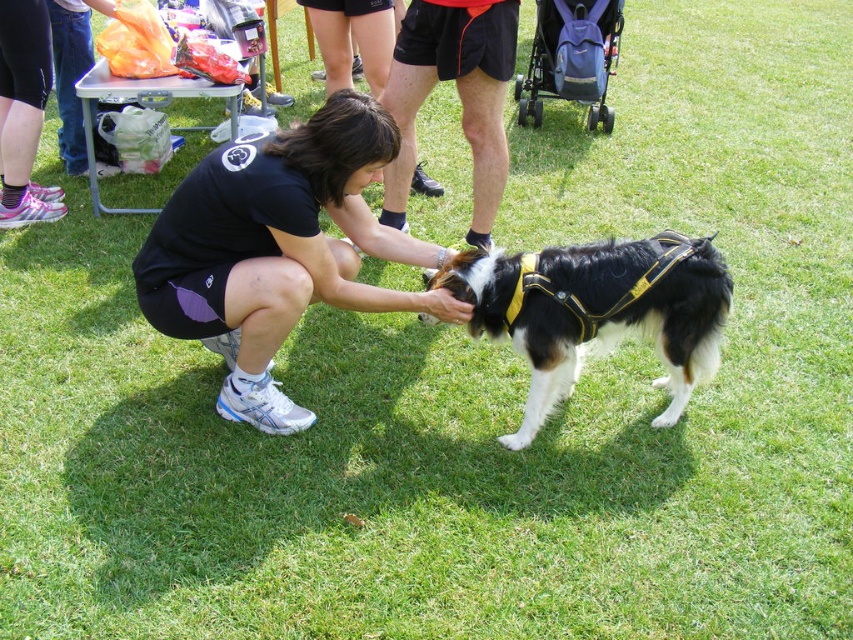
You are a photographer standing at the center of the field. You want to take a photo of the black fabric squat at center. Where should you point your camera to capture it?

You should point your camera towards the coordinates point (x=276, y=250) to capture the black fabric squat at center.

You are a photographer taking a picture of the scene. You need to ensure that the black fabric squat at center is visible above the black and white fur at center in your photo. Is this currently the case?

Yes, the black fabric squat at center is positioned over the black and white fur at center, so it is visible above in the current arrangement.

You are a photographer trying to capture a photo of the black fabric squat at center and the black and white fur at center. Which object should you focus on first if you want to ensure both are in focus, considering their heights?

The black fabric squat at center is taller than the black and white fur at center. Therefore, focusing on the taller object first will help ensure both are in focus.